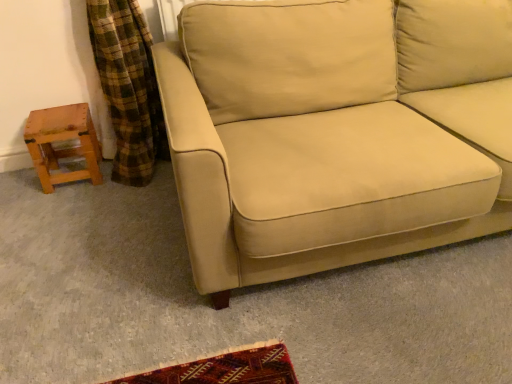
Where is `free space to the left of wooden stool at left`? free space to the left of wooden stool at left is located at coordinates (17, 178).